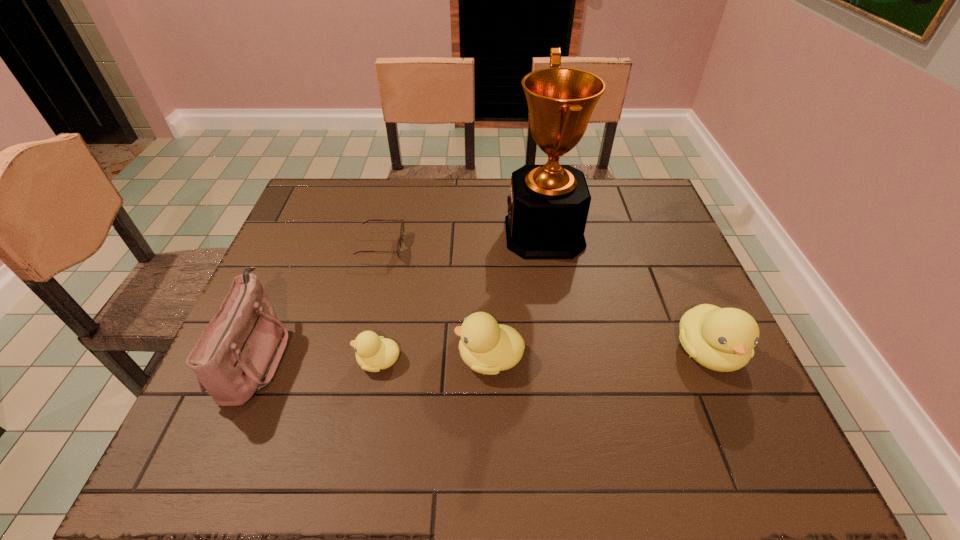
Find the location of a particular element. free space between the shortest object and the tallest object is located at coordinates (463, 240).

The image size is (960, 540). Identify the location of vacant space that is in between the leftmost object and the trophy cup. (400, 295).

Select which object appears as the fourth closest to the leftmost duckling. Please provide its 2D coordinates. Your answer should be formatted as a tuple, i.e. [(x, y)], where the tuple contains the x and y coordinates of a point satisfying the conditions above.

[(548, 206)]

Select which object appears as the third closest to the spectacles. Please provide its 2D coordinates. Your answer should be formatted as a tuple, i.e. [(x, y)], where the tuple contains the x and y coordinates of a point satisfying the conditions above.

[(487, 347)]

Identify which duckling is the closest to the leftmost object. Please provide its 2D coordinates. Your answer should be formatted as a tuple, i.e. [(x, y)], where the tuple contains the x and y coordinates of a point satisfying the conditions above.

[(374, 353)]

Select which duckling appears as the closest to the fourth tallest object. Please provide its 2D coordinates. Your answer should be formatted as a tuple, i.e. [(x, y)], where the tuple contains the x and y coordinates of a point satisfying the conditions above.

[(374, 353)]

This screenshot has height=540, width=960. Identify the location of vacant space that satisfies the following two spatial constraints: 1. at the beak of the rightmost duckling; 2. at the beak of the fourth tallest object. (710, 357).

You are a GUI agent. You are given a task and a screenshot of the screen. Output one action in this format:
    pyautogui.click(x=<x>, y=<y>)
    Task: Click on the vacant space that satisfies the following two spatial constraints: 1. at the beak of the rightmost duckling; 2. on the front pocket of the leftmost object
    The image size is (960, 540).
    Given the screenshot: What is the action you would take?
    pyautogui.click(x=710, y=357)

The height and width of the screenshot is (540, 960). Find the location of `vacant space that satisfies the following two spatial constraints: 1. at the beak of the rightmost duckling; 2. at the beak of the shortest duckling`. vacant space that satisfies the following two spatial constraints: 1. at the beak of the rightmost duckling; 2. at the beak of the shortest duckling is located at coordinates (712, 361).